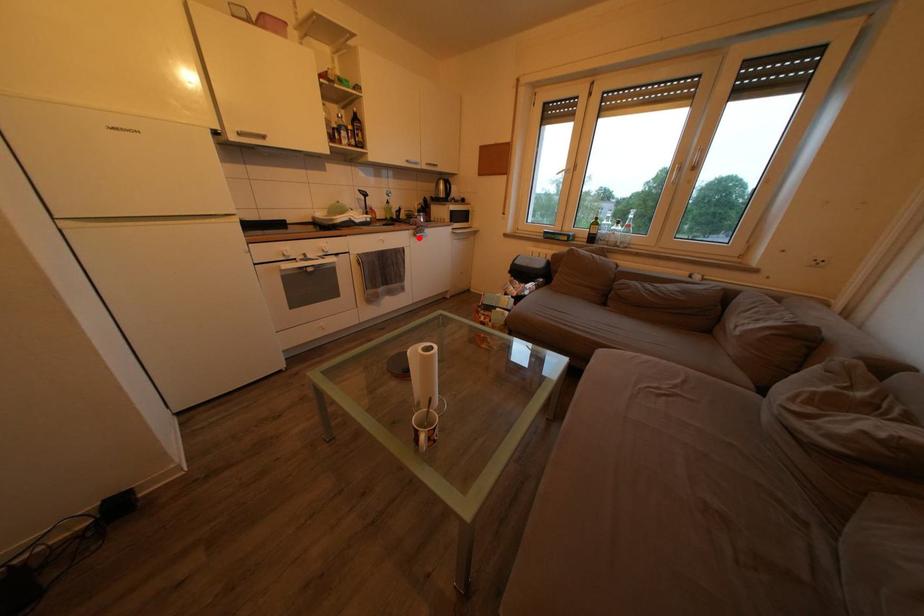
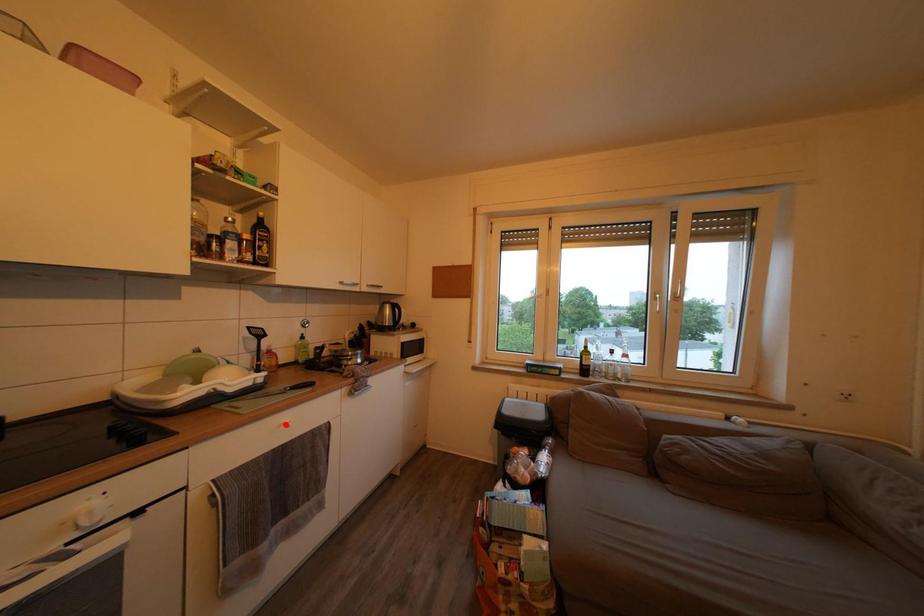
I am providing you with two images of the same scene from different viewpoints. A red point is marked on the first image and another point is marked on the second image. Do the highlighted points in image1 and image2 indicate the same real-world spot?

No